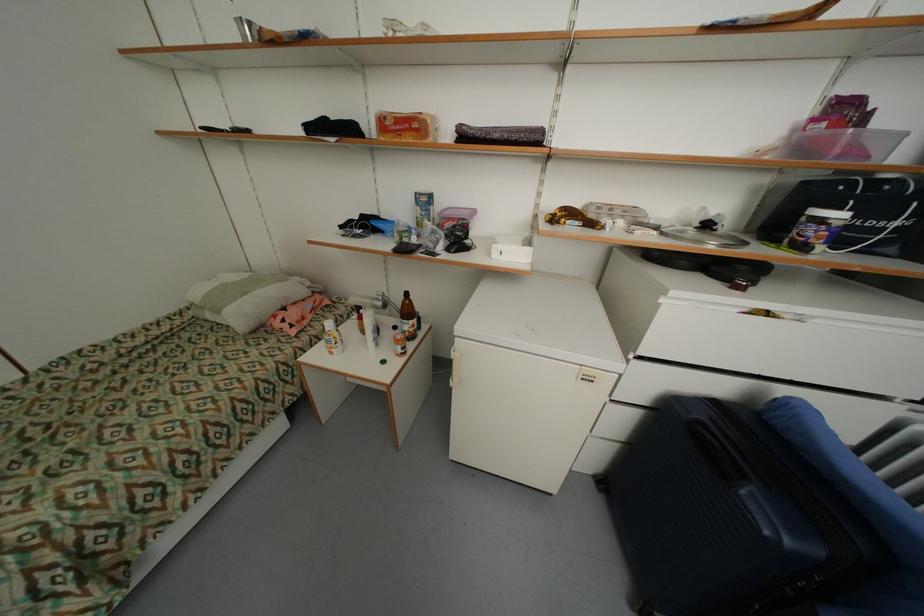
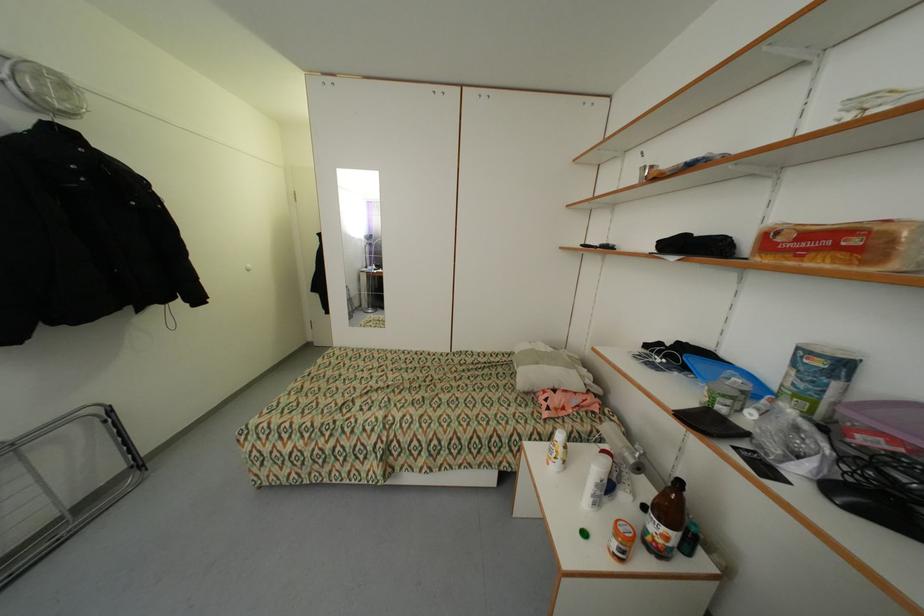
Question: Based on the continuous images, in which direction is the camera rotating? Reply with the corresponding letter.

Choices:
 (A) Left
 (B) Right
 (C) Up
 (D) Down

Answer: (A)